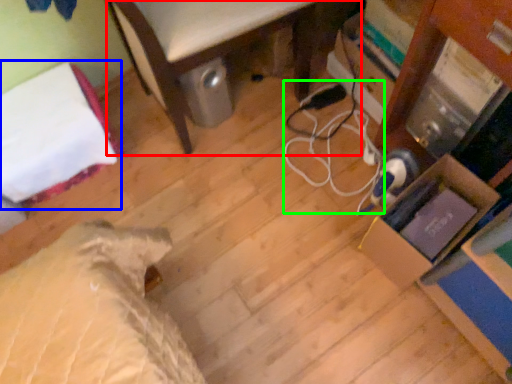
Question: Which object is the farthest from furniture (highlighted by a red box)? Choose among these: bed (highlighted by a blue box) or cable (highlighted by a green box).

Choices:
 (A) bed
 (B) cable

Answer: (A)